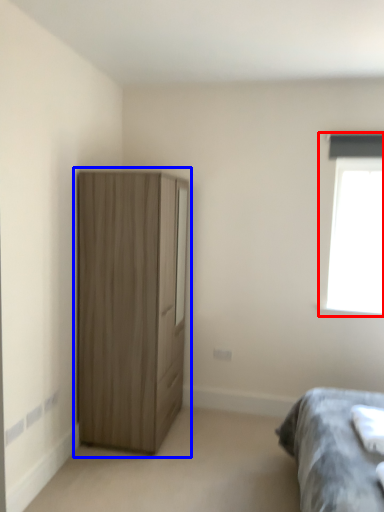
Question: Which object is closer to the camera taking this photo, window (highlighted by a red box) or cupboard (highlighted by a blue box)?

Choices:
 (A) window
 (B) cupboard

Answer: (B)